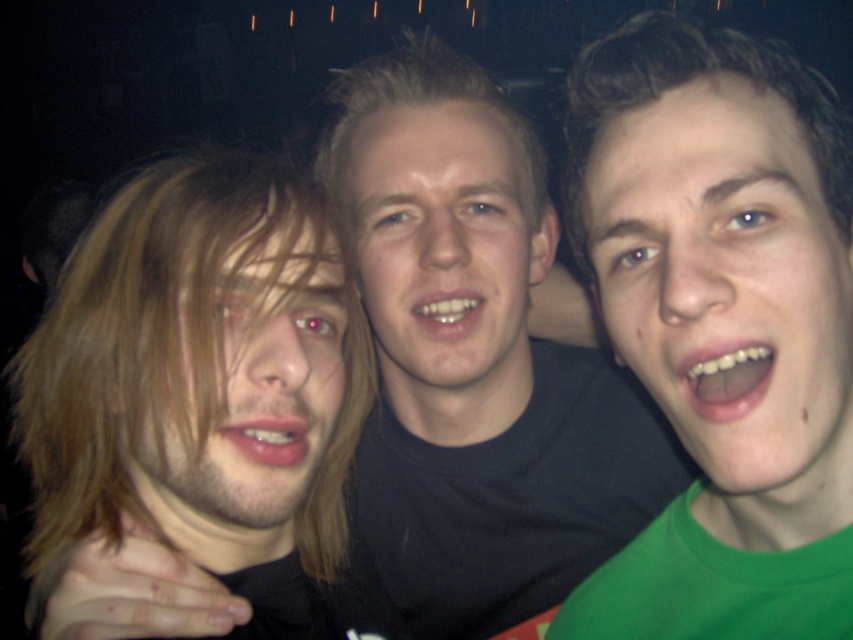
You are a photographer trying to focus your camera on the green matte face at right and the blond hair at center. Which one is nearer to you?

The green matte face at right is closer to the viewer than blond hair at center, so the photographer should focus on the green matte face at right first as it is nearer.

You are standing in a dark area with two points marked in the scene. The first point is at coordinate point(193, 262) and the second is at point(396, 150). Which point is closer to you?

Point(193, 262) is in front of point(396, 150), so it is closer to you.

You are a photographer trying to capture a closeup of the green matte face at right. You are currently standing 18 inches away from it. Based on the scene, will you need to move closer or farther away to get the shot?

The green matte face at right is 17.70 inches away from the viewer. Since you are currently 18 inches away, you need to move slightly closer by 0.3 inches to reach the required distance for the closeup.